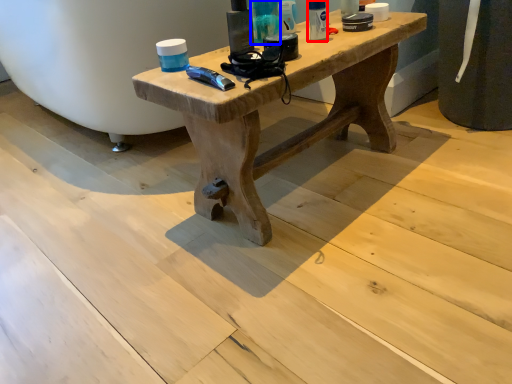
Question: Which of the following is the closest to the observer, toiletry (highlighted by a red box) or toiletry (highlighted by a blue box)?

Choices:
 (A) toiletry
 (B) toiletry

Answer: (B)